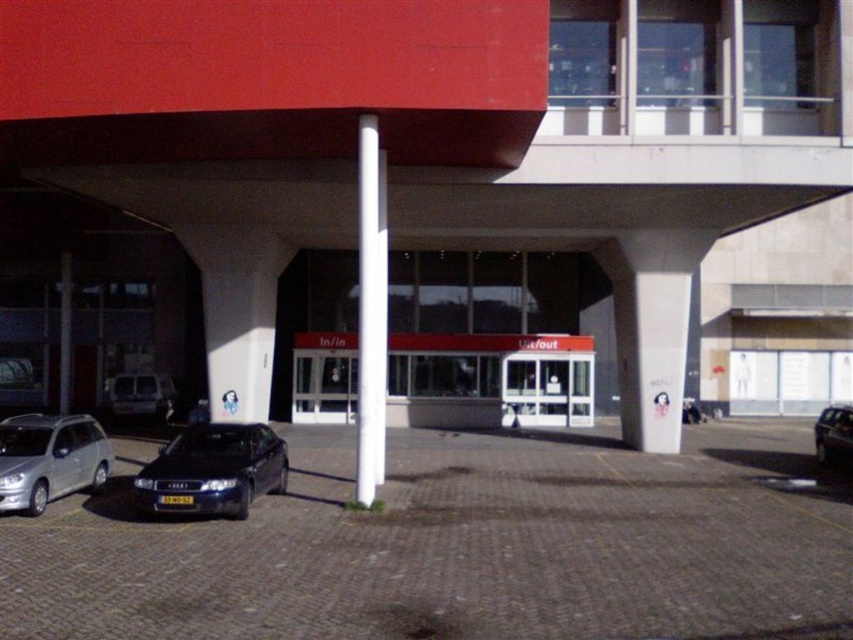
Can you confirm if gray cobblestone parking lot at center is positioned to the left of white glossy pole at center?

Incorrect, gray cobblestone parking lot at center is not on the left side of white glossy pole at center.

Is gray cobblestone parking lot at center further to camera compared to white glossy pole at center?

No.

Between point (231, 524) and point (366, 337), which one is positioned behind?

The point (366, 337) is more distant.

You are a GUI agent. You are given a task and a screenshot of the screen. Output one action in this format:
    pyautogui.click(x=<x>, y=<y>)
    Task: Click on the gray cobblestone parking lot at center
    
    Given the screenshot: What is the action you would take?
    pyautogui.click(x=463, y=547)

Which is in front, point (74, 579) or point (849, 468)?

Positioned in front is point (74, 579).

Between gray cobblestone parking lot at center and metallic silver car at lower right, which one appears on the right side from the viewer's perspective?

Positioned to the right is metallic silver car at lower right.

Identify the location of gray cobblestone parking lot at center. click(463, 547).

Where is `gray cobblestone parking lot at center`? gray cobblestone parking lot at center is located at coordinates (463, 547).

Which of these two, white glass doors at center or metallic silver car at lower right, stands shorter?

Standing shorter between the two is metallic silver car at lower right.

Can you confirm if white glass doors at center is bigger than metallic silver car at lower right?

Actually, white glass doors at center might be smaller than metallic silver car at lower right.

What do you see at coordinates (489, 380) in the screenshot? I see `white glass doors at center` at bounding box center [489, 380].

I want to click on white glass doors at center, so click(489, 380).